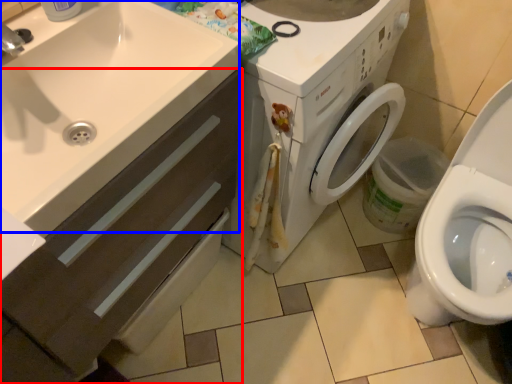
Question: Which object appears closest to the camera in this image, bathroom cabinet (highlighted by a red box) or sink (highlighted by a blue box)?

Choices:
 (A) bathroom cabinet
 (B) sink

Answer: (A)